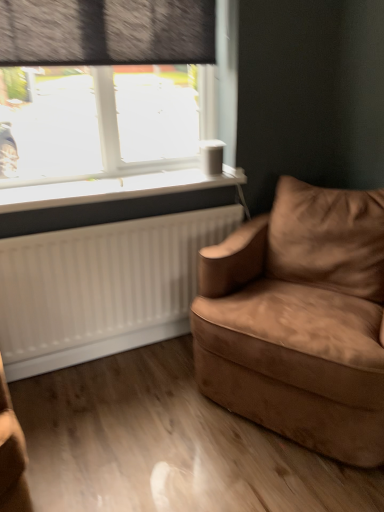
This screenshot has width=384, height=512. I want to click on vacant region under dark gray textured curtain at upper left (from a real-world perspective), so [117, 178].